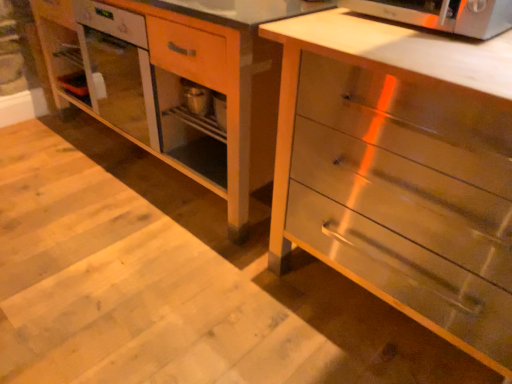
Question: Would you consider wooden vanity at center to be distant from satin silver microwave oven at upper right?

Choices:
 (A) yes
 (B) no

Answer: (B)

Question: Is wooden vanity at center at the right side of satin silver microwave oven at upper right?

Choices:
 (A) no
 (B) yes

Answer: (A)

Question: Is wooden vanity at center shorter than satin silver microwave oven at upper right?

Choices:
 (A) no
 (B) yes

Answer: (A)

Question: Does wooden vanity at center have a larger size compared to satin silver microwave oven at upper right?

Choices:
 (A) yes
 (B) no

Answer: (A)

Question: From the image's perspective, is wooden vanity at center beneath satin silver microwave oven at upper right?

Choices:
 (A) yes
 (B) no

Answer: (B)

Question: Relative to wooden vanity at center, is metallic silver chest of drawers at center in front or behind?

Choices:
 (A) behind
 (B) front

Answer: (B)

Question: Considering the positions of metallic silver chest of drawers at center and wooden vanity at center in the image, is metallic silver chest of drawers at center wider or thinner than wooden vanity at center?

Choices:
 (A) wide
 (B) thin

Answer: (B)

Question: Choose the correct answer: Is metallic silver chest of drawers at center inside wooden vanity at center or outside it?

Choices:
 (A) outside
 (B) inside

Answer: (A)

Question: Does point (422, 44) appear closer or farther from the camera than point (163, 54)?

Choices:
 (A) closer
 (B) farther

Answer: (A)

Question: From the image's perspective, is satin silver microwave oven at upper right located above or below wooden vanity at center?

Choices:
 (A) below
 (B) above

Answer: (A)

Question: Considering the positions of satin silver microwave oven at upper right and wooden vanity at center in the image, is satin silver microwave oven at upper right bigger or smaller than wooden vanity at center?

Choices:
 (A) big
 (B) small

Answer: (B)

Question: From their relative heights in the image, would you say satin silver microwave oven at upper right is taller or shorter than wooden vanity at center?

Choices:
 (A) short
 (B) tall

Answer: (A)

Question: Do you think satin silver microwave oven at upper right is within wooden vanity at center, or outside of it?

Choices:
 (A) inside
 (B) outside

Answer: (B)

Question: In terms of height, does metallic silver chest of drawers at center look taller or shorter compared to satin silver microwave oven at upper right?

Choices:
 (A) short
 (B) tall

Answer: (B)

Question: Choose the correct answer: Is metallic silver chest of drawers at center inside satin silver microwave oven at upper right or outside it?

Choices:
 (A) outside
 (B) inside

Answer: (A)